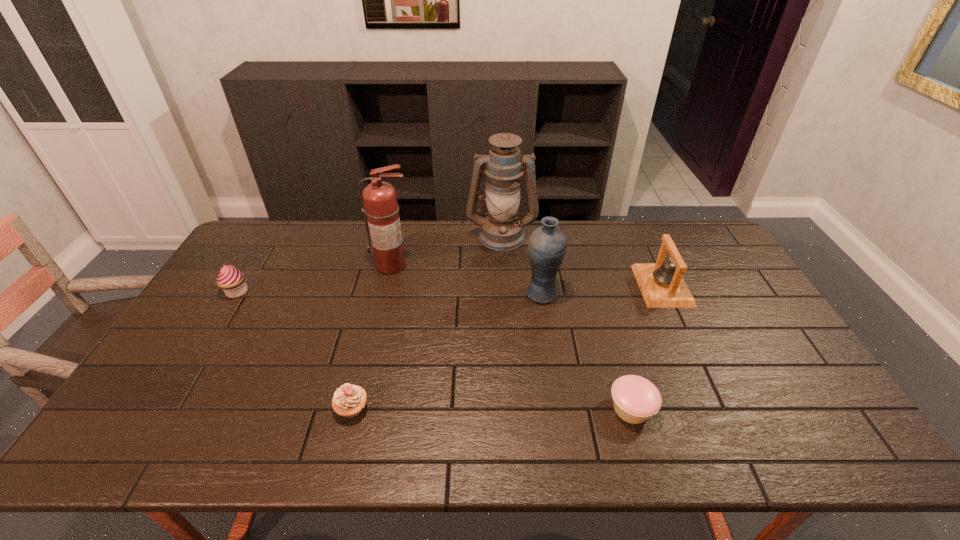
Identify the location of free space that satisfies the following two spatial constraints: 1. on the back side of the oil lamp; 2. on the right side of the sixth tallest object. The image size is (960, 540). (395, 235).

At what (x,y) coordinates should I click in order to perform the action: click on free spot that satisfies the following two spatial constraints: 1. on the back side of the leftmost object; 2. on the right side of the oil lamp. Please return your answer as a coordinate pair (x, y). Looking at the image, I should click on (272, 235).

Identify the location of vacant space that satisfies the following two spatial constraints: 1. on the front-facing side of the fire extinguisher; 2. on the right side of the rightmost object. The width and height of the screenshot is (960, 540). (387, 286).

Where is `vacant position in the image that satisfies the following two spatial constraints: 1. on the front-facing side of the fire extinguisher; 2. on the right side of the shortest cupcake`? This screenshot has width=960, height=540. vacant position in the image that satisfies the following two spatial constraints: 1. on the front-facing side of the fire extinguisher; 2. on the right side of the shortest cupcake is located at coordinates (358, 409).